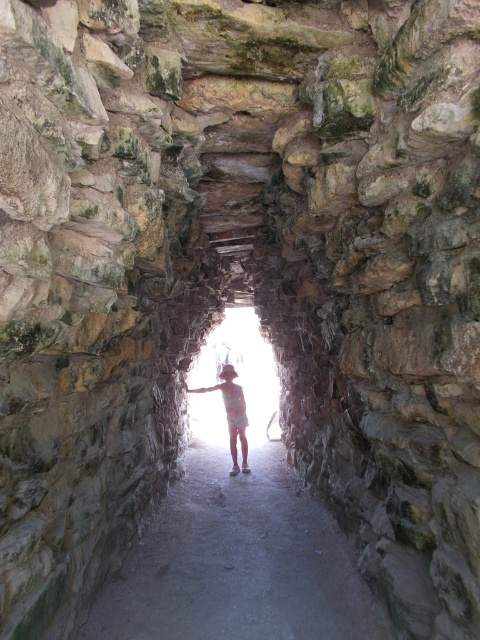
You are standing at the entrance of the tunnel and want to walk towards the light at the end. Which object will you step on first, the smooth concrete path at center or the multicolored fabric at center?

The smooth concrete path at center is in front of the multicolored fabric at center, so you will step on the smooth concrete path at center first.

You are standing at the entrance of the tunnel and want to walk towards the light. There is a smooth concrete path at center and a multicolored fabric at center. Which one is lower to the ground?

The smooth concrete path at center is not as tall as the multicolored fabric at center, so the smooth concrete path at center is lower to the ground.

You are a hiker carrying a large backpack and need to walk through the tunnel. The smooth concrete path at center and the multicolored fabric at center are both in your way. Which one do you need to avoid stepping on to stay on the path?

The multicolored fabric at center is likely the one to avoid stepping on since the smooth concrete path at center is probably the designated path, and the fabric might be an obstacle or decoration. However, according to the description, the smooth concrete path at center might be wider than multicolored fabric at center, so staying on the wider path would be advisable.